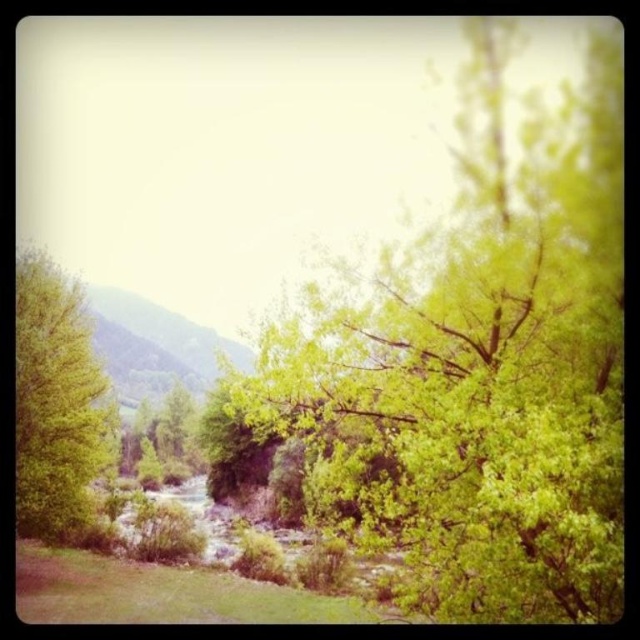
You are an environmental scientist assessing the biodiversity of this landscape. You observe the green leafy tree at center and the green leafy tree at left. Which tree has a narrower width?

The green leafy tree at center has a narrower width than the green leafy tree at left.

You are a hiker who wants to cross the river using a rope bridge that is 15 meters long. The bridge can only be anchored between the two trees. Can you anchor the bridge between the green leafy tree at center and the green leafy tree at left?

The green leafy tree at center and the green leafy tree at left are 17.72 meters apart. Since the bridge is only 15 meters long, it is not long enough to span the distance between them. You will need a longer bridge or find another pair of trees closer together.